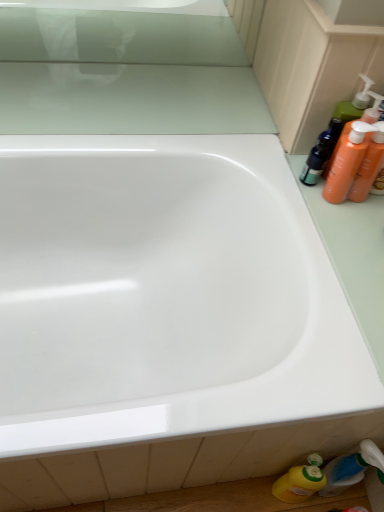
Question: Is the depth of yellow plastic bottle at lower right, positioned as the 1th cleaning product in left-to-right order, less than that of orange plastic bottles at upper right, marked as the 1th cleaning product in a right-to-left arrangement?

Choices:
 (A) no
 (B) yes

Answer: (A)

Question: From a real-world perspective, is yellow plastic bottle at lower right, acting as the second cleaning product starting from the right, physically above orange plastic bottles at upper right, marked as the 1th cleaning product in a right-to-left arrangement?

Choices:
 (A) no
 (B) yes

Answer: (A)

Question: Is yellow plastic bottle at lower right, acting as the second cleaning product starting from the right, located outside orange plastic bottles at upper right, marked as the 1th cleaning product in a right-to-left arrangement?

Choices:
 (A) yes
 (B) no

Answer: (A)

Question: From the image's perspective, is yellow plastic bottle at lower right, acting as the second cleaning product starting from the right, over orange plastic bottles at upper right, marked as the 1th cleaning product in a right-to-left arrangement?

Choices:
 (A) no
 (B) yes

Answer: (A)

Question: Is yellow plastic bottle at lower right, positioned as the 1th cleaning product in left-to-right order, placed right next to orange plastic bottles at upper right, marked as the 1th cleaning product in a right-to-left arrangement?

Choices:
 (A) yes
 (B) no

Answer: (B)

Question: Can you confirm if yellow plastic bottle at lower right, positioned as the 1th cleaning product in left-to-right order, is taller than orange plastic bottles at upper right, marked as the 1th cleaning product in a right-to-left arrangement?

Choices:
 (A) yes
 (B) no

Answer: (A)

Question: Is orange plastic bottles at upper right, marked as the second cleaning product in a left-to-right arrangement, oriented towards white glossy bathtub at center?

Choices:
 (A) no
 (B) yes

Answer: (A)

Question: Is orange plastic bottles at upper right, positioned as the 2th cleaning product in bottom-to-top order, outside of white glossy bathtub at center?

Choices:
 (A) no
 (B) yes

Answer: (B)

Question: From a real-world perspective, is orange plastic bottles at upper right, marked as the 1th cleaning product in a right-to-left arrangement, beneath white glossy bathtub at center?

Choices:
 (A) no
 (B) yes

Answer: (A)

Question: From a real-world perspective, is orange plastic bottles at upper right, marked as the 1th cleaning product in a right-to-left arrangement, on top of white glossy bathtub at center?

Choices:
 (A) no
 (B) yes

Answer: (B)

Question: Is orange plastic bottles at upper right, the first cleaning product positioned from the top, closer to the viewer compared to white glossy bathtub at center?

Choices:
 (A) no
 (B) yes

Answer: (A)

Question: From the image's perspective, would you say orange plastic bottles at upper right, marked as the 1th cleaning product in a right-to-left arrangement, is shown under white glossy bathtub at center?

Choices:
 (A) no
 (B) yes

Answer: (A)

Question: Is orange plastic bottles at upper right, positioned as the 2th cleaning product in bottom-to-top order, a part of translucent plastic bottle at lower right, the 1th toiletry from the bottom?

Choices:
 (A) yes
 (B) no

Answer: (B)